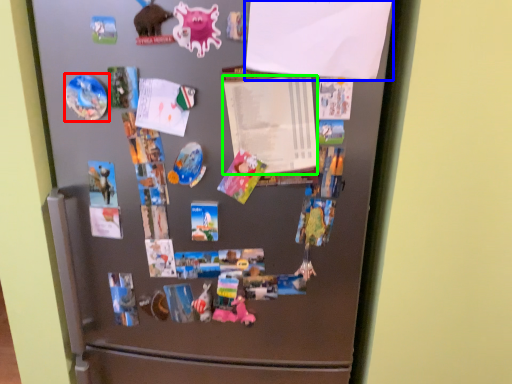
Question: Which object is positioned closest to art (highlighted by a red box)? Select from paper (highlighted by a blue box) and paper (highlighted by a green box).

Choices:
 (A) paper
 (B) paper

Answer: (B)